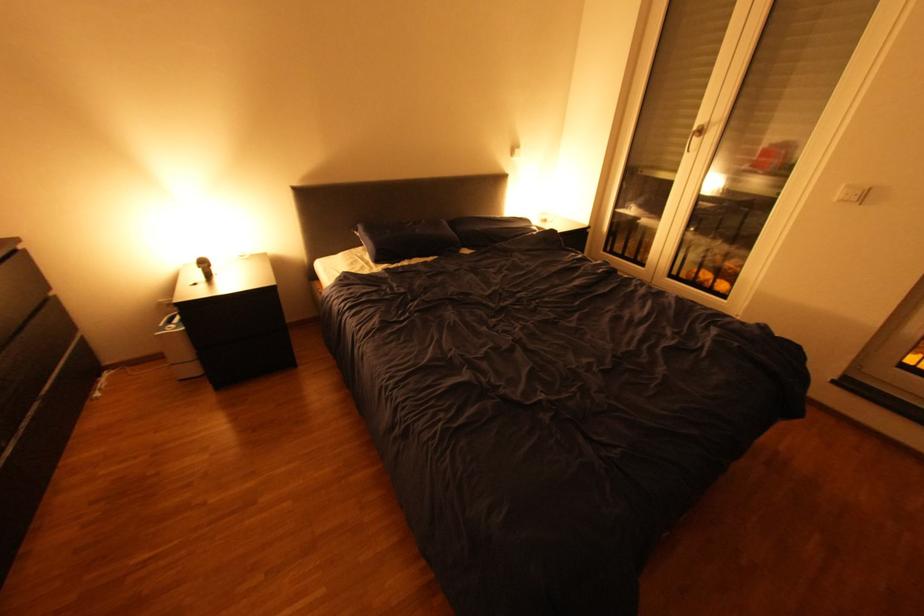
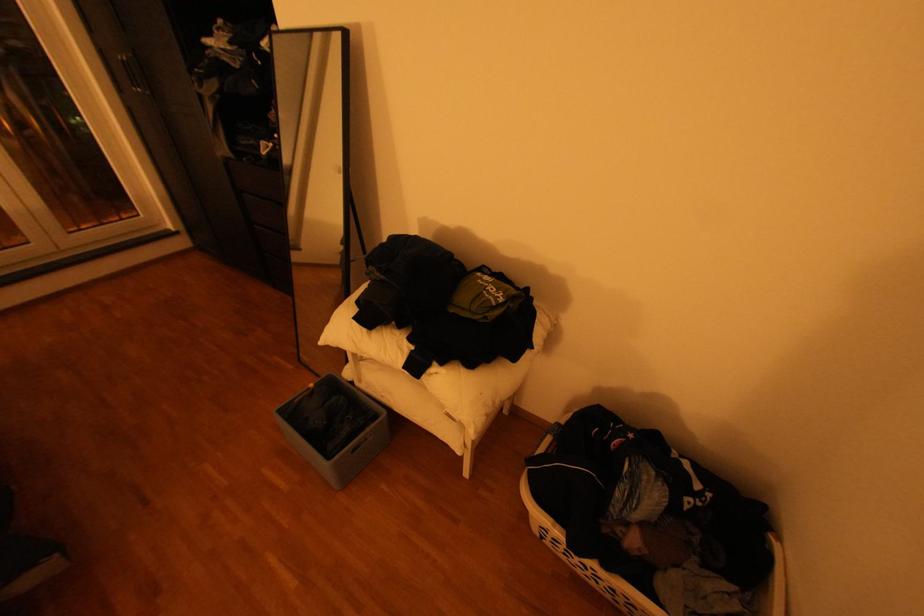
First-person continuous shooting, in which direction is the camera rotating?

The rotation direction of the camera is right-down.